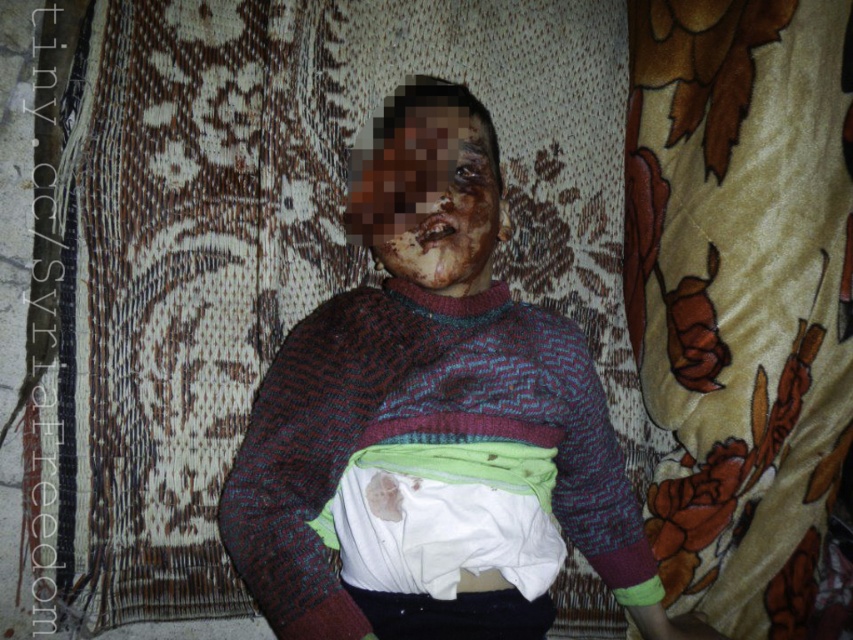
Looking at this image, does knitted sweater at center have a lesser width compared to scarred skin at center?

In fact, knitted sweater at center might be wider than scarred skin at center.

Is knitted sweater at center bigger than scarred skin at center?

Yes.

Identify the location of knitted sweater at center. The image size is (853, 640). (434, 445).